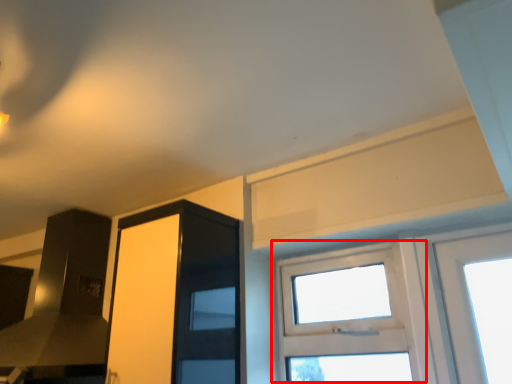
Question: In this image, where is window (annotated by the red box) located relative to screen door?

Choices:
 (A) left
 (B) right

Answer: (B)